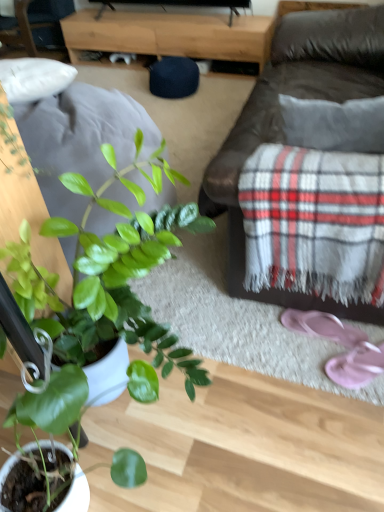
Question: Does pink fabric flip-flops at lower right, the 2th footwear from the back, have a smaller size compared to brown leather couch at center?

Choices:
 (A) yes
 (B) no

Answer: (A)

Question: Can you confirm if pink fabric flip-flops at lower right, marked as the 1th footwear in a front-to-back arrangement, is shorter than brown leather couch at center?

Choices:
 (A) no
 (B) yes

Answer: (B)

Question: Considering the relative positions of pink fabric flip-flops at lower right, marked as the 1th footwear in a front-to-back arrangement, and brown leather couch at center in the image provided, is pink fabric flip-flops at lower right, marked as the 1th footwear in a front-to-back arrangement, in front of brown leather couch at center?

Choices:
 (A) yes
 (B) no

Answer: (B)

Question: From a real-world perspective, does pink fabric flip-flops at lower right, marked as the 1th footwear in a front-to-back arrangement, stand above brown leather couch at center?

Choices:
 (A) yes
 (B) no

Answer: (B)

Question: From a real-world perspective, is pink fabric flip-flops at lower right, marked as the 1th footwear in a front-to-back arrangement, beneath brown leather couch at center?

Choices:
 (A) yes
 (B) no

Answer: (A)

Question: In terms of size, does pink fabric flip-flops at lower right, the 2th footwear positioned from the front, appear bigger or smaller than pink fabric flip-flops at lower right, the 2th footwear from the back?

Choices:
 (A) big
 (B) small

Answer: (B)

Question: In terms of height, does pink fabric flip-flops at lower right, the 2th footwear positioned from the front, look taller or shorter compared to pink fabric flip-flops at lower right, marked as the 1th footwear in a front-to-back arrangement?

Choices:
 (A) short
 (B) tall

Answer: (B)

Question: Is pink fabric flip-flops at lower right, the 2th footwear positioned from the front, inside or outside of pink fabric flip-flops at lower right, marked as the 1th footwear in a front-to-back arrangement?

Choices:
 (A) outside
 (B) inside

Answer: (A)

Question: From the image's perspective, is pink fabric flip-flops at lower right, the 1th footwear viewed from the back, located above or below pink fabric flip-flops at lower right, the 2th footwear from the back?

Choices:
 (A) below
 (B) above

Answer: (B)

Question: Is brown leather couch at center wider or thinner than pink fabric flip-flops at lower right, the 2th footwear from the back?

Choices:
 (A) thin
 (B) wide

Answer: (B)

Question: Considering the positions of brown leather couch at center and pink fabric flip-flops at lower right, marked as the 1th footwear in a front-to-back arrangement, in the image, is brown leather couch at center taller or shorter than pink fabric flip-flops at lower right, marked as the 1th footwear in a front-to-back arrangement,?

Choices:
 (A) short
 (B) tall

Answer: (B)

Question: Visually, is brown leather couch at center positioned to the left or to the right of pink fabric flip-flops at lower right, marked as the 1th footwear in a front-to-back arrangement?

Choices:
 (A) right
 (B) left

Answer: (B)

Question: From a real-world perspective, relative to pink fabric flip-flops at lower right, the 2th footwear from the back, is brown leather couch at center vertically above or below?

Choices:
 (A) below
 (B) above

Answer: (B)

Question: From a real-world perspective, is pink fabric flip-flops at lower right, the 2th footwear positioned from the front, physically located above or below green matte plant at lower left?

Choices:
 (A) below
 (B) above

Answer: (A)

Question: From the image's perspective, relative to green matte plant at lower left, is pink fabric flip-flops at lower right, the 2th footwear positioned from the front, above or below?

Choices:
 (A) below
 (B) above

Answer: (A)